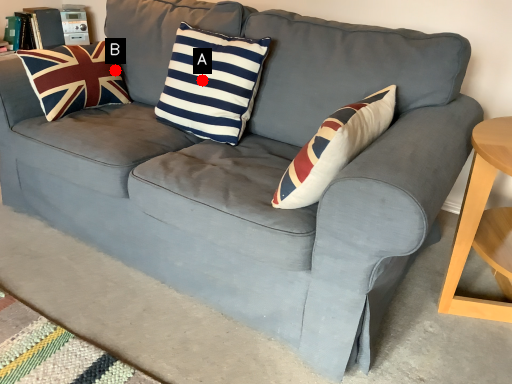
Question: Two points are circled on the image, labeled by A and B beside each circle. Which of the following is the farthest from the observer?

Choices:
 (A) A is further
 (B) B is further

Answer: (B)